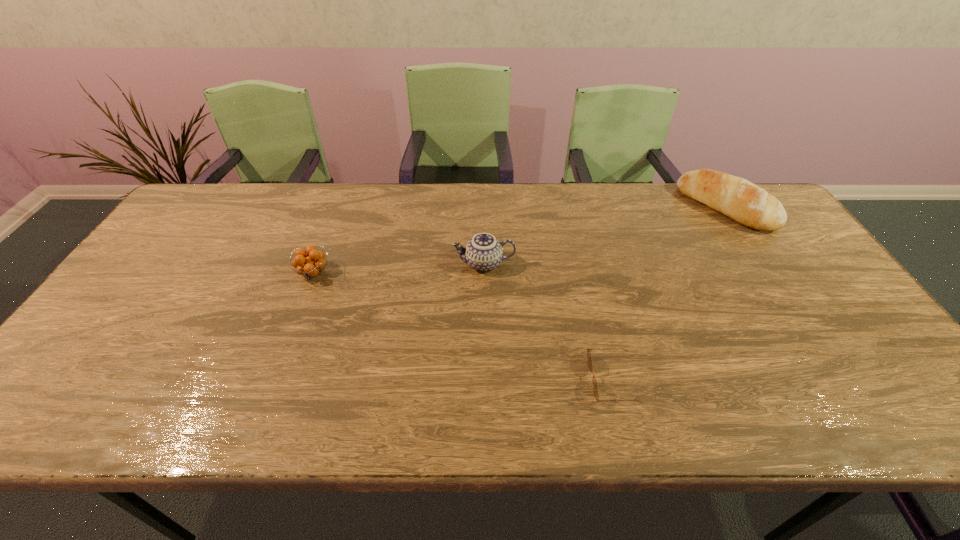
At what (x,y) coordinates should I click in order to perform the action: click on vacant point located 0.240m from the spout of the chinaware. Please return your answer as a coordinate pair (x, y). This screenshot has height=540, width=960. Looking at the image, I should click on (369, 264).

Where is `free location located on the back of the leftmost object`? The width and height of the screenshot is (960, 540). free location located on the back of the leftmost object is located at coordinates (323, 249).

This screenshot has width=960, height=540. I want to click on free space located 0.130m on the face of the nearest object, so click(x=533, y=379).

Locate an element on the screen. The height and width of the screenshot is (540, 960). vacant space located on the face of the nearest object is located at coordinates (426, 379).

Where is `vacant space located 0.170m on the face of the nearest object`? This screenshot has height=540, width=960. vacant space located 0.170m on the face of the nearest object is located at coordinates (516, 379).

You are a GUI agent. You are given a task and a screenshot of the screen. Output one action in this format:
    pyautogui.click(x=<x>, y=<y>)
    Task: Click on the object present at the far edge
    The height and width of the screenshot is (540, 960).
    Given the screenshot: What is the action you would take?
    pyautogui.click(x=737, y=198)

Find the location of a particular element. The width and height of the screenshot is (960, 540). object that is at the near edge is located at coordinates (589, 358).

In order to click on object that is at the right edge in this screenshot , I will do `click(737, 198)`.

The width and height of the screenshot is (960, 540). Find the location of `object that is at the far right corner`. object that is at the far right corner is located at coordinates (737, 198).

The image size is (960, 540). Identify the location of vacant area at the far edge of the desktop. (x=468, y=206).